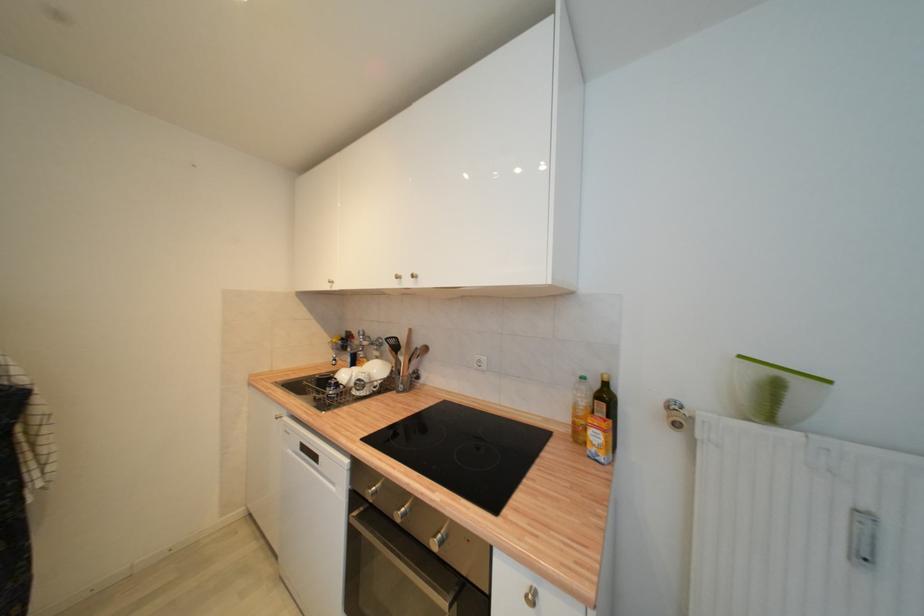
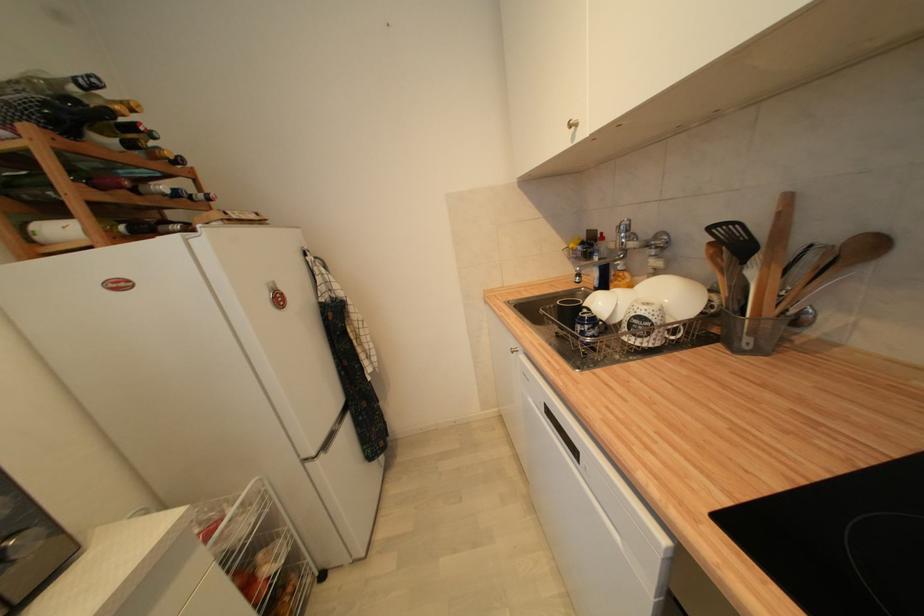
Find the pixel in the second image that matches (334,389) in the first image.

(588, 326)